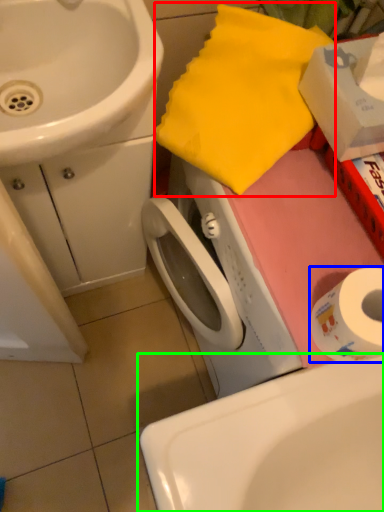
Question: Which is farther away from beach towel (highlighted by a red box)? toilet paper (highlighted by a blue box) or sink (highlighted by a green box)?

Choices:
 (A) toilet paper
 (B) sink

Answer: (B)